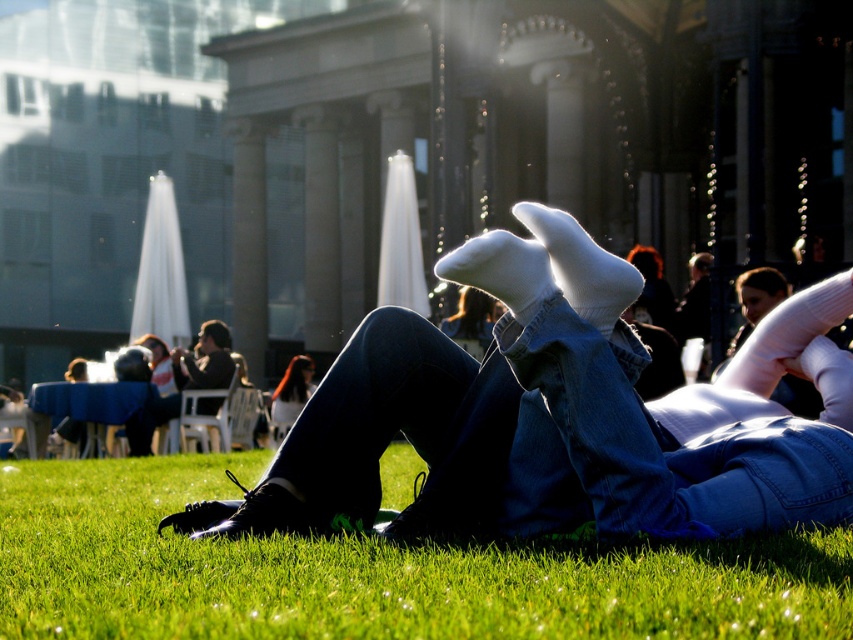
Between denim jeans at center and blonde hair at center, which one is positioned lower?

blonde hair at center is below.

Does denim jeans at center appear under blonde hair at center?

No.

In order to click on denim jeans at center in this screenshot , I will do `click(561, 413)`.

In order to click on denim jeans at center in this screenshot , I will do `click(561, 413)`.

The width and height of the screenshot is (853, 640). What do you see at coordinates (372, 572) in the screenshot? I see `green grass at lower center` at bounding box center [372, 572].

Between point (451, 630) and point (289, 419), which one is positioned behind?

Point (289, 419)

Where is `green grass at lower center`? green grass at lower center is located at coordinates (372, 572).

Is green grass at lower center thinner than dark brown leather jacket at upper left?

No.

Between green grass at lower center and dark brown leather jacket at upper left, which one is positioned higher?

dark brown leather jacket at upper left is above.

Find the location of a particular element. green grass at lower center is located at coordinates (372, 572).